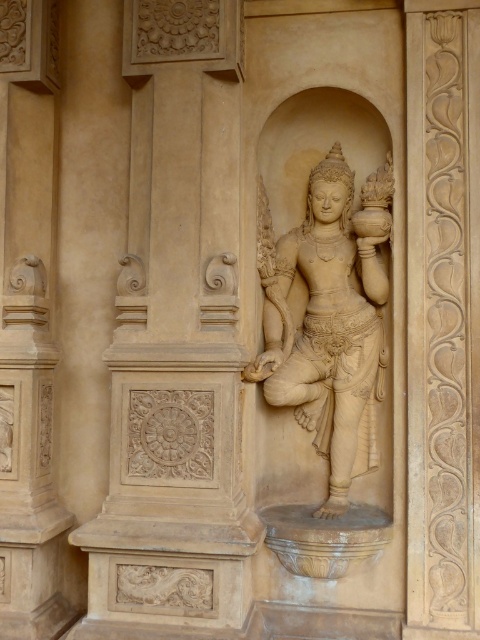
Question: Which point appears farthest from the camera in this image?

Choices:
 (A) (373, 365)
 (B) (205, 572)

Answer: (A)

Question: Which of the following is the closest to the observer?

Choices:
 (A) (180, 620)
 (B) (289, 362)

Answer: (A)

Question: Is beige stone column at center wider than beige stone statue at center?

Choices:
 (A) no
 (B) yes

Answer: (B)

Question: Among these points, which one is farthest from the camera?

Choices:
 (A) (171, 497)
 (B) (354, 378)

Answer: (B)

Question: Does beige stone column at center come in front of beige stone statue at center?

Choices:
 (A) yes
 (B) no

Answer: (A)

Question: Can you confirm if beige stone column at center is positioned to the right of beige stone statue at center?

Choices:
 (A) yes
 (B) no

Answer: (B)